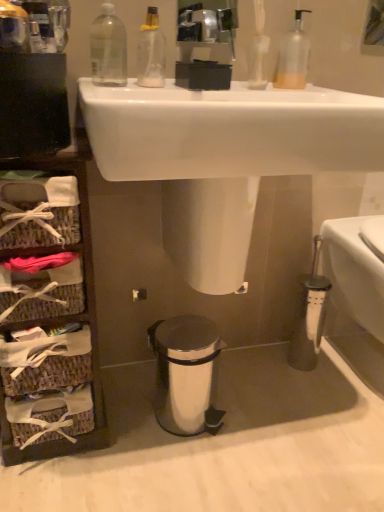
I want to click on free space to the right of silver metallic trash can at lower center, so click(x=249, y=413).